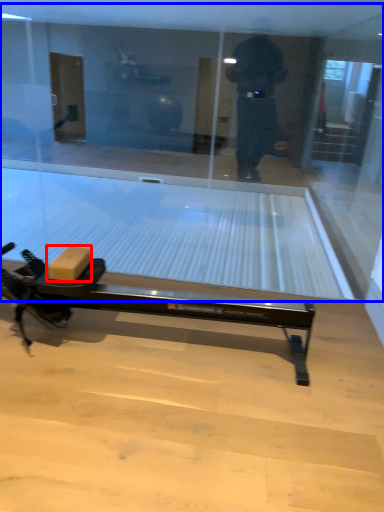
Question: Which point is closer to the camera, cardboard box (highlighted by a red box) or shop window (highlighted by a blue box)?

Choices:
 (A) cardboard box
 (B) shop window

Answer: (A)